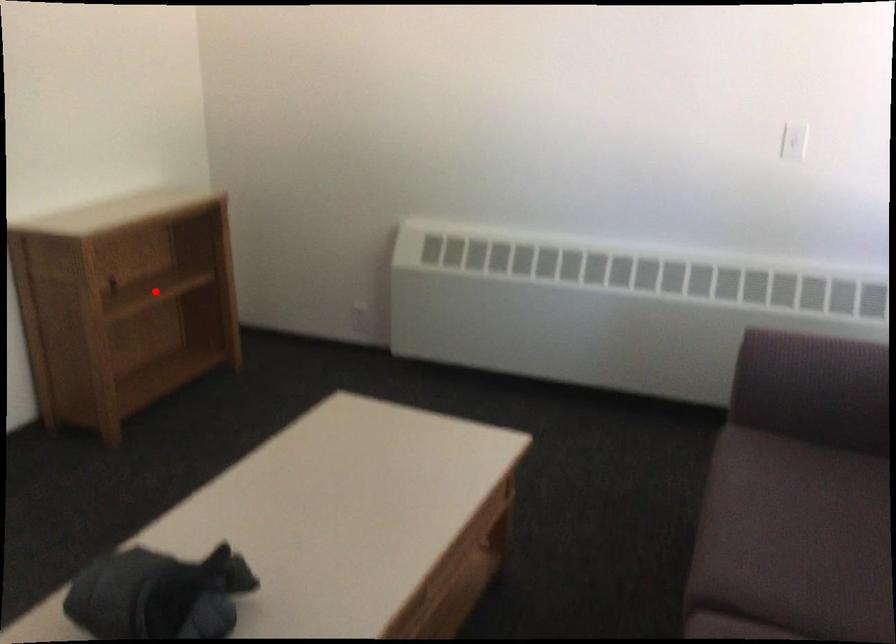
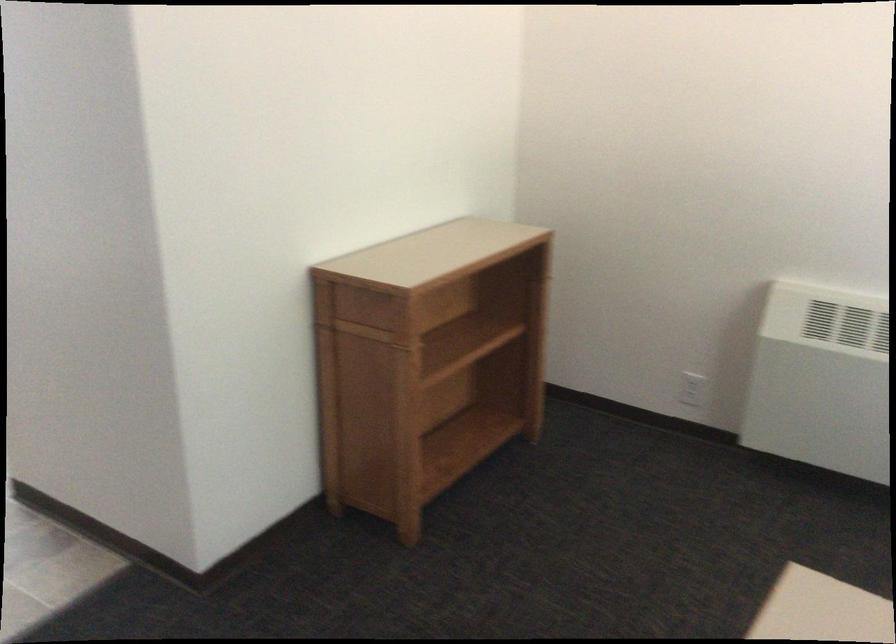
Question: A red point is marked in image1. In image2, is the corresponding 3D point closer to the camera or farther? Reply with the corresponding letter.

Choices:
 (A) The corresponding 3D point is closer.
 (B) The corresponding 3D point is farther.

Answer: (A)